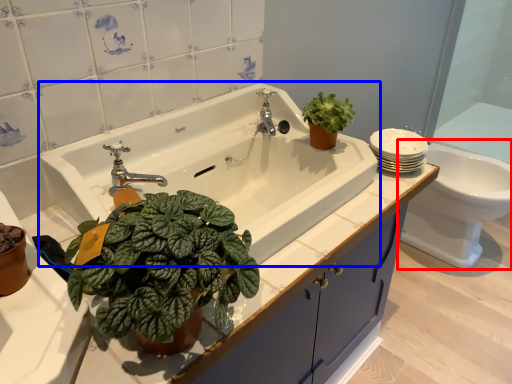
Question: Which object appears closest to the camera in this image, toilet (highlighted by a red box) or sink (highlighted by a blue box)?

Choices:
 (A) toilet
 (B) sink

Answer: (B)